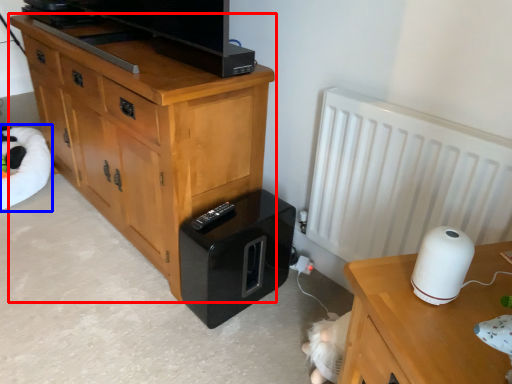
Question: Which point is further to the camera, chest of drawers (highlighted by a red box) or bean bag chair (highlighted by a blue box)?

Choices:
 (A) chest of drawers
 (B) bean bag chair

Answer: (B)